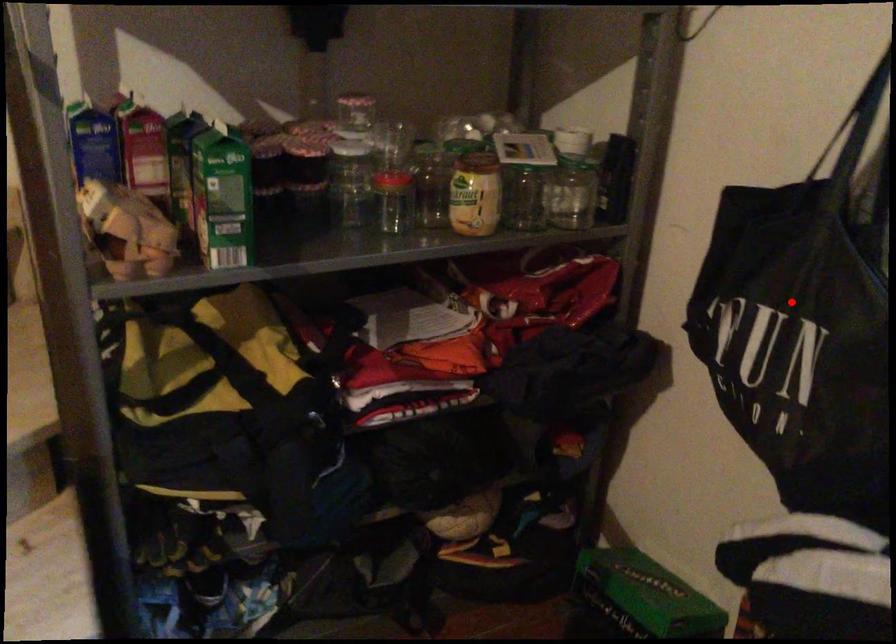
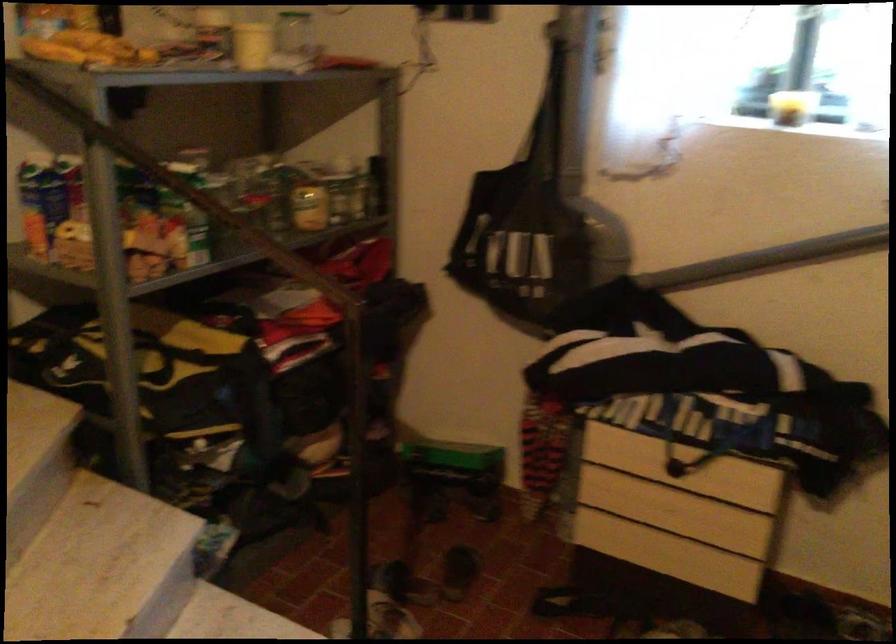
Question: I am providing you with two images of the same scene from different viewpoints. In image1, a red point is highlighted. Considering the same 3D point in image2, which of the following is correct?

Choices:
 (A) It is closer
 (B) It is farther

Answer: (B)